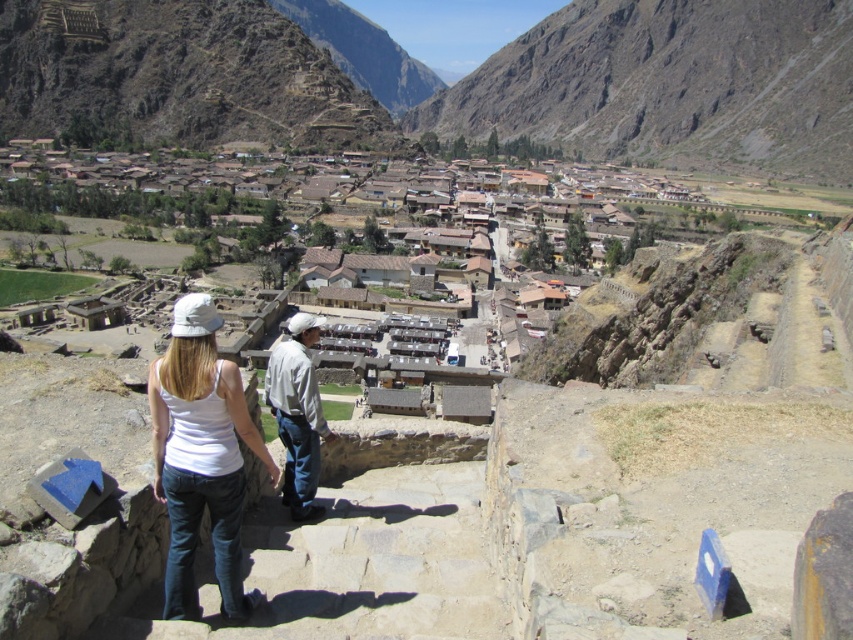
Is point (218, 492) less distant than point (318, 429)?

Yes, it is.

At what (x,y) coordinates should I click in order to perform the action: click on white cotton tank top at center. Please return your answer as a coordinate pair (x, y). Looking at the image, I should click on (201, 458).

At what (x,y) coordinates should I click in order to perform the action: click on white cotton tank top at center. Please return your answer as a coordinate pair (x, y). This screenshot has width=853, height=640. Looking at the image, I should click on (201, 458).

Does brown rocky mountain at upper center have a lesser width compared to light gray cotton shirt at center?

In fact, brown rocky mountain at upper center might be wider than light gray cotton shirt at center.

From the picture: Does brown rocky mountain at upper center appear on the left side of light gray cotton shirt at center?

Incorrect, brown rocky mountain at upper center is not on the left side of light gray cotton shirt at center.

Is point (775, 156) farther from viewer compared to point (312, 470)?

Yes, point (775, 156) is farther from viewer.

What are the coordinates of `brown rocky mountain at upper center` in the screenshot? It's located at (670, 84).

Does brown rocky mountain at upper center appear over white cotton tank top at center?

Indeed, brown rocky mountain at upper center is positioned over white cotton tank top at center.

Is brown rocky mountain at upper center bigger than white cotton tank top at center?

Yes.

Find the location of a particular element. Image resolution: width=853 pixels, height=640 pixels. brown rocky mountain at upper center is located at coordinates (670, 84).